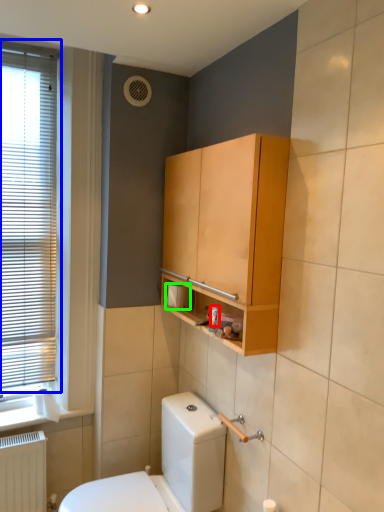
Question: Which is farther away from toiletry (highlighted by a red box)? window (highlighted by a blue box) or toilet paper (highlighted by a green box)?

Choices:
 (A) window
 (B) toilet paper

Answer: (A)